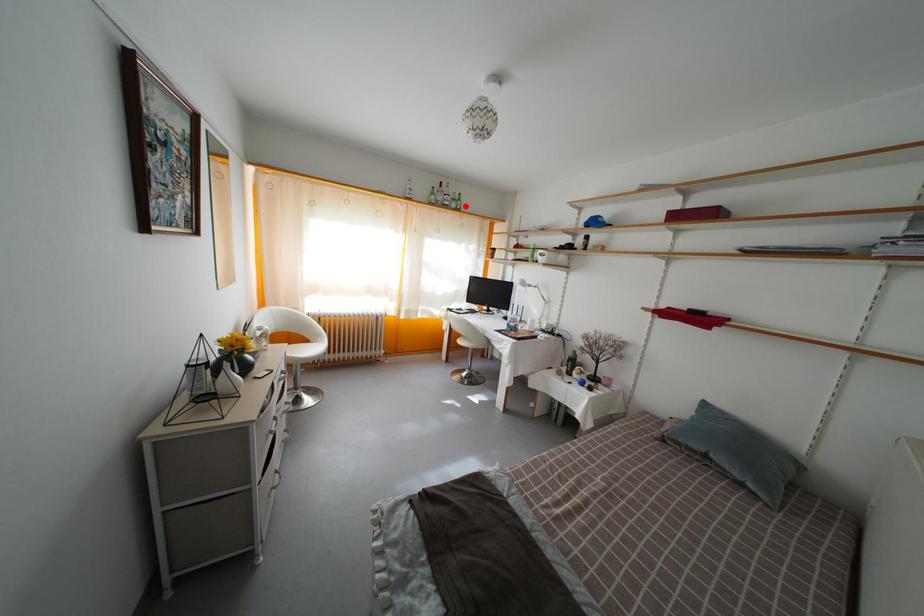
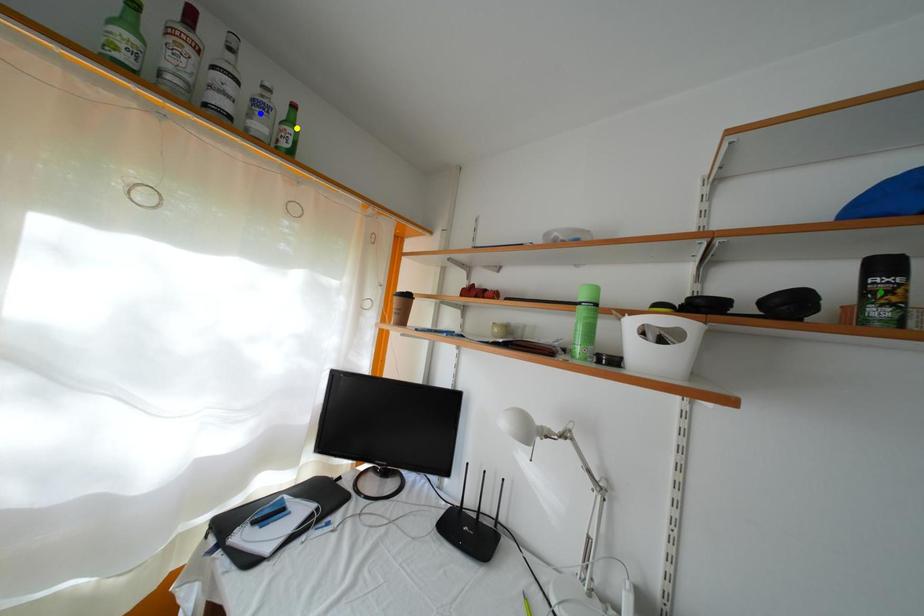
Question: I am providing you with two images of the same scene from different viewpoints. A red point is marked on the first image. You are given multiple points on the second image. Which spot in image 2 lines up with the point in image 1?

Choices:
 (A) blue point
 (B) yellow point
 (C) green point

Answer: (B)